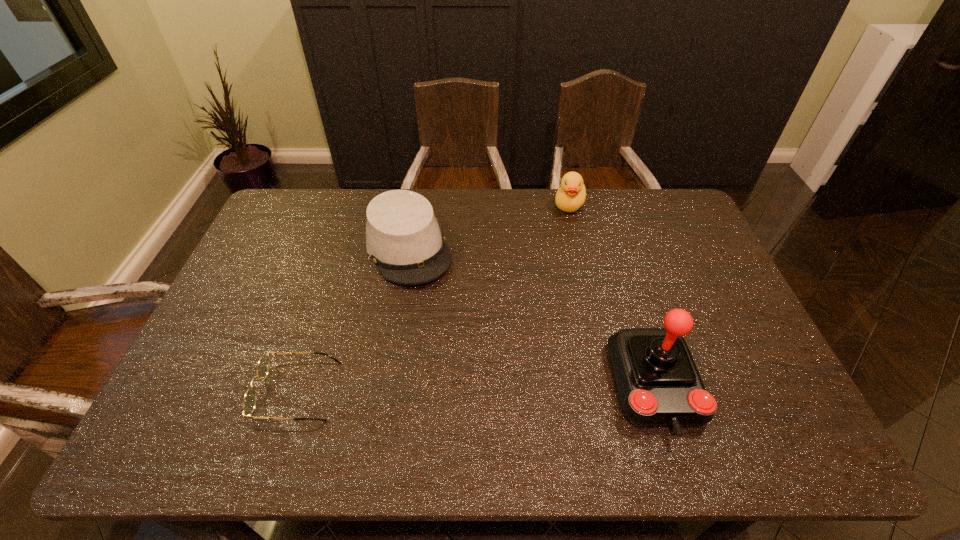
At what (x,y) coordinates should I click in order to perform the action: click on free space on the desktop that is between the shortest object and the joystick and is positioned on the front-facing side of the hat. Please return your answer as a coordinate pair (x, y). Image resolution: width=960 pixels, height=540 pixels. Looking at the image, I should click on (486, 389).

This screenshot has width=960, height=540. I want to click on vacant spot on the desktop that is between the shortest object and the joystick and is positioned at the beak of the duck, so click(480, 389).